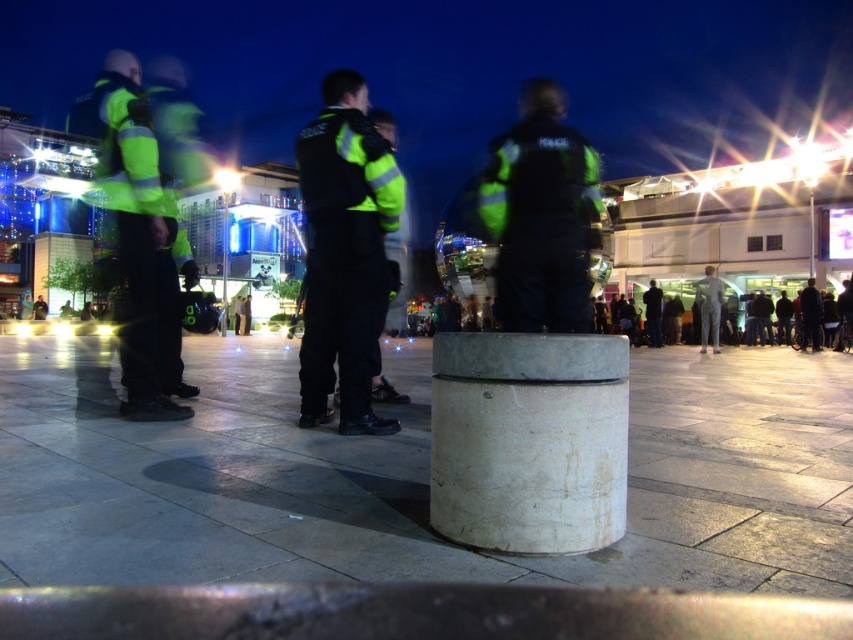
You are standing in the nighttime plaza and need to determine which of the two points, point (618, 445) or point (376, 164), is nearer to you. Based on the scene description, which point is closer?

Point (618, 445) is closer to the viewer than point (376, 164).